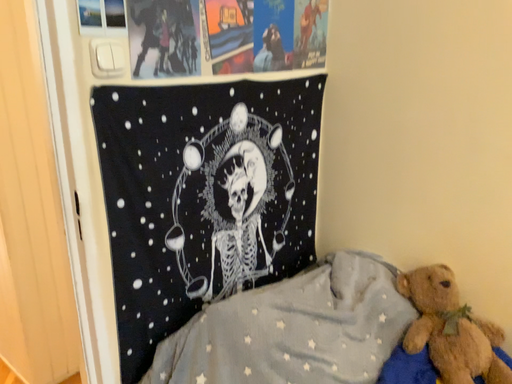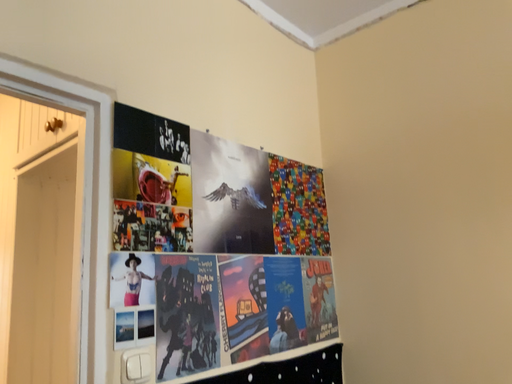
Question: How did the camera likely rotate when shooting the video?

Choices:
 (A) rotated downward
 (B) rotated upward

Answer: (B)